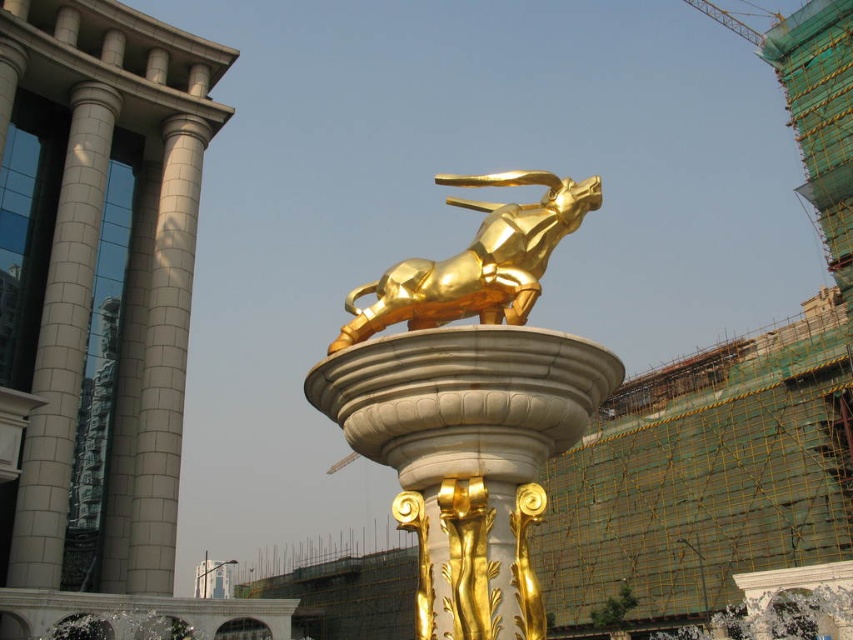
Does gold polished statue at center appear over gold polished bull at center?

Actually, gold polished statue at center is below gold polished bull at center.

Between gold polished statue at center and gold polished bull at center, which one has less height?

gold polished bull at center is shorter.

This screenshot has width=853, height=640. What are the coordinates of `gold polished statue at center` in the screenshot? It's located at (469, 403).